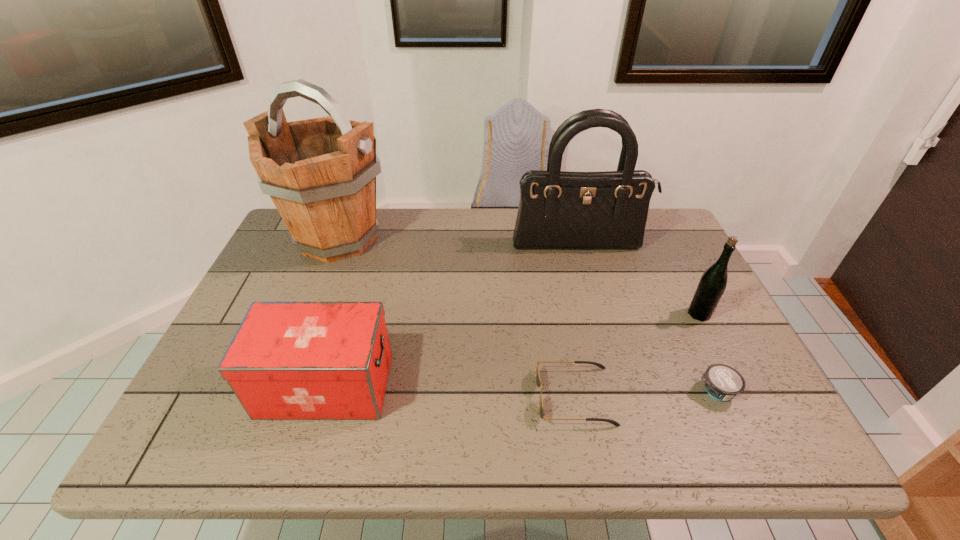
At what (x,y) coordinates should I click in order to perform the action: click on vacant space situated 0.300m on the handle side of the fourth tallest object. Please return your answer as a coordinate pair (x, y). This screenshot has width=960, height=540. Looking at the image, I should click on (x=525, y=386).

What are the coordinates of `vacant space situated 0.260m on the front-facing side of the sunglasses` in the screenshot? It's located at (418, 396).

Image resolution: width=960 pixels, height=540 pixels. In order to click on free location located 0.340m on the front-facing side of the sunglasses in this screenshot , I will do `click(380, 396)`.

Where is `vacant area situated on the front-facing side of the sunglasses`? vacant area situated on the front-facing side of the sunglasses is located at coordinates point(372,396).

Locate an element on the screen. This screenshot has height=540, width=960. vacant region located on the back of the yogurt is located at coordinates (660, 269).

Locate an element on the screen. bucket at the far edge is located at coordinates (320, 173).

The height and width of the screenshot is (540, 960). In order to click on handbag that is positioned at the far edge in this screenshot , I will do `click(558, 210)`.

Locate an element on the screen. the first-aid kit that is at the near edge is located at coordinates (288, 360).

The width and height of the screenshot is (960, 540). I want to click on sunglasses that is at the near edge, so click(x=538, y=381).

You are a GUI agent. You are given a task and a screenshot of the screen. Output one action in this format:
    pyautogui.click(x=<x>, y=<y>)
    Task: Click on the bucket located at the left edge
    This screenshot has height=540, width=960.
    Given the screenshot: What is the action you would take?
    pyautogui.click(x=320, y=173)